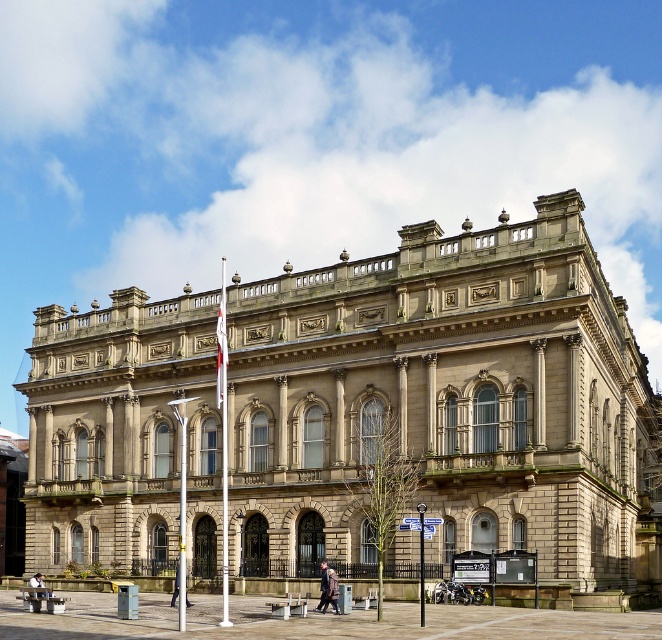
Question: From the image, what is the correct spatial relationship of brown leather coat at center in relation to dark gray suit at center?

Choices:
 (A) left
 (B) right

Answer: (B)

Question: Considering the relative positions of brown leather coat at center and light brown leather jacket at center in the image provided, where is brown leather coat at center located with respect to light brown leather jacket at center?

Choices:
 (A) above
 (B) below

Answer: (A)

Question: Which point appears farthest from the camera in this image?

Choices:
 (A) (175, 584)
 (B) (312, 609)

Answer: (A)

Question: Which object is farther from the camera taking this photo?

Choices:
 (A) beige stone building at center
 (B) brown leather coat at center
 (C) dark gray suit at center

Answer: (A)

Question: Can you confirm if brown leather coat at center is positioned above dark gray suit at center?

Choices:
 (A) no
 (B) yes

Answer: (B)

Question: Based on their relative distances, which object is farther from the brown leather coat at center?

Choices:
 (A) beige stone building at center
 (B) light brown leather jacket at center
 (C) dark gray suit at center

Answer: (A)